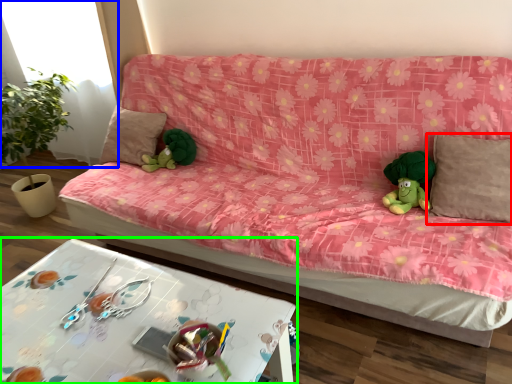
Question: Which object is the closest to the pillow (highlighted by a red box)? Choose among these: window (highlighted by a blue box) or table (highlighted by a green box).

Choices:
 (A) window
 (B) table

Answer: (B)